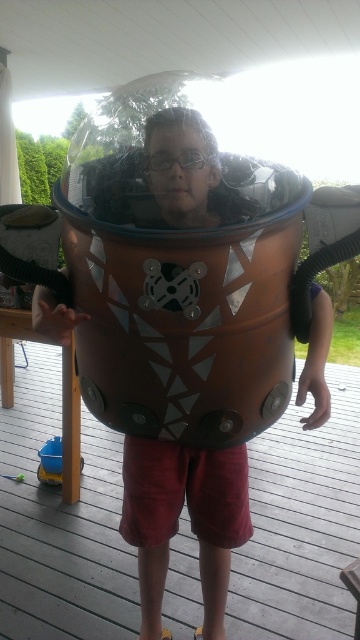
Question: From the image, what is the correct spatial relationship of matte brown helmet at center in relation to blue plastic toy at lower left?

Choices:
 (A) right
 (B) left

Answer: (A)

Question: Does matte brown helmet at center appear on the left side of blue plastic toy at lower left?

Choices:
 (A) no
 (B) yes

Answer: (A)

Question: Is matte brown helmet at center positioned in front of blue plastic toy at lower left?

Choices:
 (A) no
 (B) yes

Answer: (B)

Question: Which point is closer to the camera?

Choices:
 (A) (37, 468)
 (B) (155, 595)

Answer: (B)